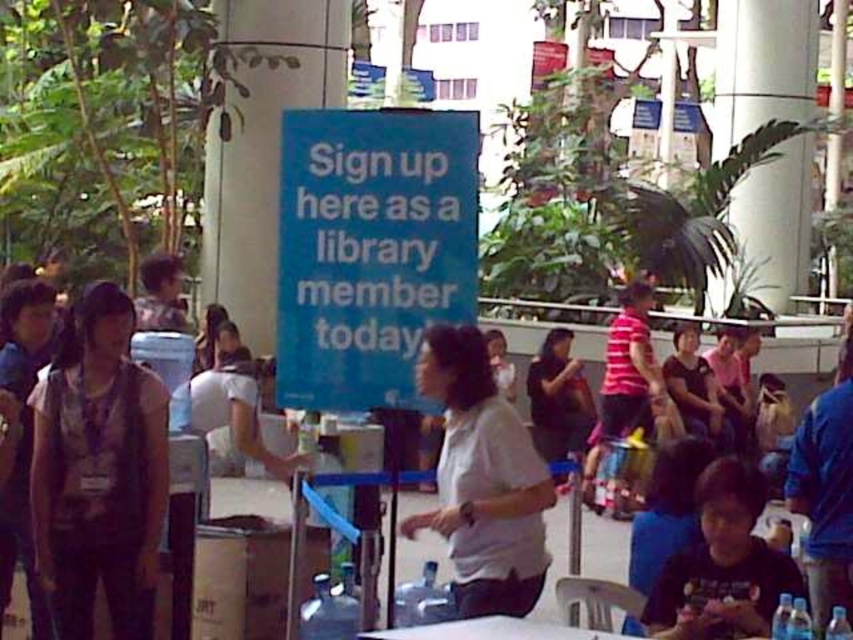
Question: Considering the relative positions of blue paper sign at center and matte gray tank top at left in the image provided, where is blue paper sign at center located with respect to matte gray tank top at left?

Choices:
 (A) left
 (B) right

Answer: (B)

Question: Which object is closer to the camera taking this photo?

Choices:
 (A) dark gray shirt at center
 (B) white matte shirt at center
 (C) white plastic table at lower center

Answer: (C)

Question: Considering the real-world distances, which object is closest to the matte gray tank top at left?

Choices:
 (A) blue paper sign at center
 (B) dark gray shirt at center
 (C) white matte shirt at center
 (D) white plastic table at lower center

Answer: (A)

Question: Considering the relative positions of white matte shirt at center and black matte shirt at lower right in the image provided, where is white matte shirt at center located with respect to black matte shirt at lower right?

Choices:
 (A) left
 (B) right

Answer: (A)

Question: Is matte gray tank top at left to the right of white matte shirt at center from the viewer's perspective?

Choices:
 (A) no
 (B) yes

Answer: (A)

Question: Considering the real-world distances, which object is farthest from the dark gray shirt at center?

Choices:
 (A) blue paper sign at center
 (B) matte gray tank top at left
 (C) black matte shirt at lower right
 (D) white matte shirt at center

Answer: (B)